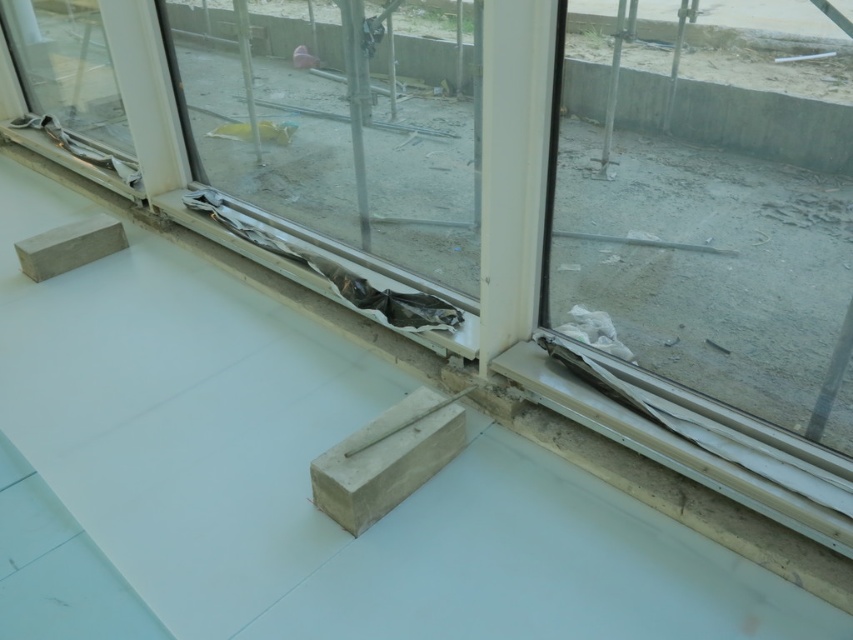
Can you confirm if transparent glass door at right is taller than transparent plastic glass door at center?

In fact, transparent glass door at right may be shorter than transparent plastic glass door at center.

From the picture: Does transparent glass door at right come in front of transparent plastic glass door at center?

Yes.

At what (x,y) coordinates should I click in order to perform the action: click on transparent glass door at right. Please return your answer as a coordinate pair (x, y). This screenshot has height=640, width=853. Looking at the image, I should click on (711, 200).